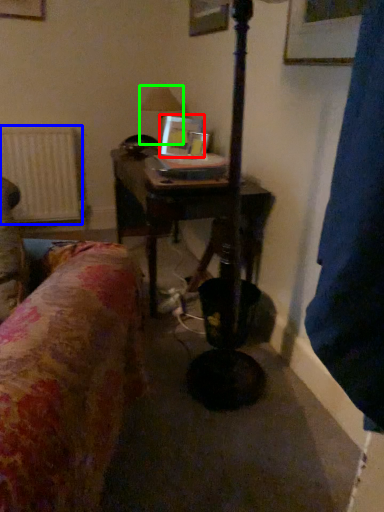
Question: Based on their relative distances, which object is farther from picture frame (highlighted by a red box)? Choose from radiator (highlighted by a blue box) and table lamp (highlighted by a green box).

Choices:
 (A) radiator
 (B) table lamp

Answer: (A)